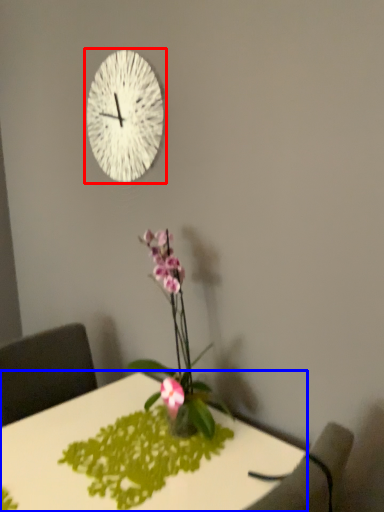
Question: Which of the following is the farthest to the observer, wall clock (highlighted by a red box) or desk (highlighted by a blue box)?

Choices:
 (A) wall clock
 (B) desk

Answer: (A)